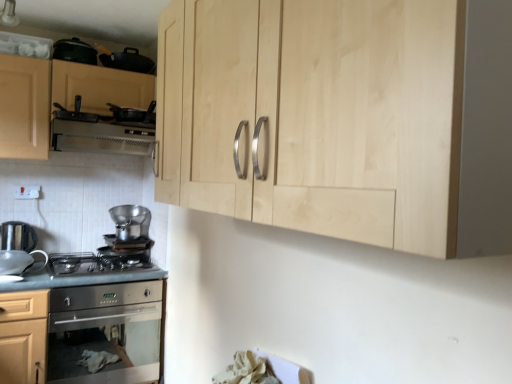
Question: From a real-world perspective, is satin silver gas stove at lower left on top of stainless steel countertop at lower left?

Choices:
 (A) no
 (B) yes

Answer: (B)

Question: Is stainless steel countertop at lower left inside satin silver gas stove at lower left?

Choices:
 (A) yes
 (B) no

Answer: (B)

Question: Considering the relative positions of satin silver gas stove at lower left and stainless steel countertop at lower left in the image provided, is satin silver gas stove at lower left in front of stainless steel countertop at lower left?

Choices:
 (A) yes
 (B) no

Answer: (B)

Question: From a real-world perspective, is satin silver gas stove at lower left beneath stainless steel countertop at lower left?

Choices:
 (A) no
 (B) yes

Answer: (A)

Question: Is satin silver gas stove at lower left smaller than stainless steel countertop at lower left?

Choices:
 (A) no
 (B) yes

Answer: (B)

Question: Does satin silver gas stove at lower left appear on the left side of stainless steel countertop at lower left?

Choices:
 (A) yes
 (B) no

Answer: (B)

Question: Considering the relative sizes of matte black pan at upper left, the first appliance positioned from the top, and white plastic electric outlet at lower left in the image provided, is matte black pan at upper left, the first appliance positioned from the top, smaller than white plastic electric outlet at lower left?

Choices:
 (A) no
 (B) yes

Answer: (A)

Question: From the image's perspective, is matte black pan at upper left, which is the fifth appliance from bottom to top, beneath white plastic electric outlet at lower left?

Choices:
 (A) no
 (B) yes

Answer: (A)

Question: Can you confirm if matte black pan at upper left, the first appliance positioned from the top, is positioned to the right of white plastic electric outlet at lower left?

Choices:
 (A) yes
 (B) no

Answer: (A)

Question: Does matte black pan at upper left, the first appliance positioned from the top, have a lesser height compared to white plastic electric outlet at lower left?

Choices:
 (A) yes
 (B) no

Answer: (B)

Question: From the image's perspective, is matte black pan at upper left, the first appliance positioned from the top, located above white plastic electric outlet at lower left?

Choices:
 (A) yes
 (B) no

Answer: (A)

Question: Is matte black pan at upper left, which is the fifth appliance from bottom to top, further to camera compared to white plastic electric outlet at lower left?

Choices:
 (A) yes
 (B) no

Answer: (B)

Question: Can you confirm if matte black pan at upper left, the first appliance positioned from the top, is shorter than black matte frying pan at upper left, the 4th appliance when ordered from bottom to top?

Choices:
 (A) yes
 (B) no

Answer: (B)